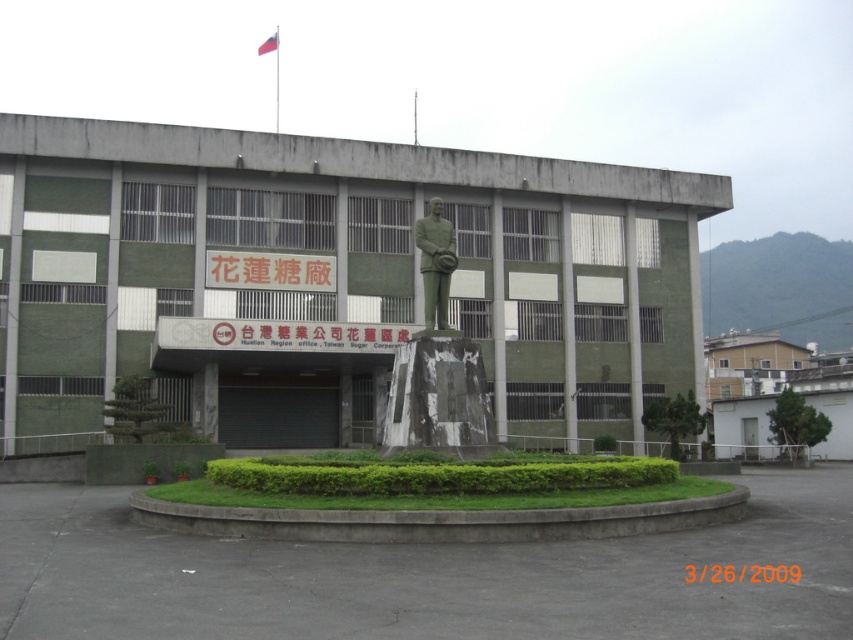
Where is `green polished statue at center`? green polished statue at center is located at coordinates (434, 262).

Can you confirm if green polished statue at center is positioned above white fabric flag at upper center?

Incorrect, green polished statue at center is not positioned above white fabric flag at upper center.

Locate an element on the screen. The height and width of the screenshot is (640, 853). green polished statue at center is located at coordinates (434, 262).

Which of these two, green marble statue at center or white fabric flag at upper center, stands taller?

Standing taller between the two is green marble statue at center.

Which is below, green marble statue at center or white fabric flag at upper center?

green marble statue at center is lower down.

Is point (415, 410) positioned after point (270, 49)?

That is False.

The image size is (853, 640). What are the coordinates of `green marble statue at center` in the screenshot? It's located at (437, 362).

Does green marble statue at center have a lesser height compared to green polished statue at center?

Incorrect, green marble statue at center's height does not fall short of green polished statue at center's.

How distant is green marble statue at center from green polished statue at center?

The distance of green marble statue at center from green polished statue at center is 3.64 feet.

This screenshot has width=853, height=640. Find the location of `green marble statue at center`. green marble statue at center is located at coordinates (437, 362).

The image size is (853, 640). What are the coordinates of `green marble statue at center` in the screenshot? It's located at (437, 362).